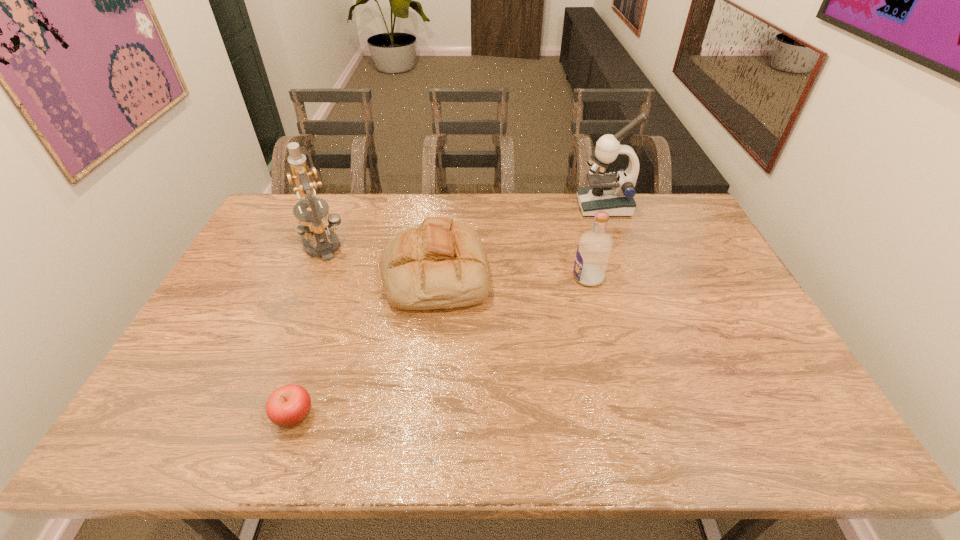
The image size is (960, 540). What are the coordinates of `free space located 0.200m on the label of the third shortest object` in the screenshot? It's located at (508, 278).

This screenshot has height=540, width=960. In order to click on free space located 0.290m on the label of the third shortest object in this screenshot , I will do `click(478, 278)`.

Find the location of a particular element. This screenshot has height=540, width=960. free location located 0.200m on the label of the third shortest object is located at coordinates (508, 278).

Locate an element on the screen. The width and height of the screenshot is (960, 540). vacant region located 0.160m on the right of the third object from right to left is located at coordinates (540, 274).

Find the location of a particular element. The width and height of the screenshot is (960, 540). vacant space located on the left of the shortest object is located at coordinates (144, 415).

You are a GUI agent. You are given a task and a screenshot of the screen. Output one action in this format:
    pyautogui.click(x=<x>, y=<y>)
    Task: Click on the object located at the near edge
    
    Given the screenshot: What is the action you would take?
    pyautogui.click(x=289, y=405)

The image size is (960, 540). I want to click on vacant space at the far edge of the desktop, so click(x=371, y=208).

Image resolution: width=960 pixels, height=540 pixels. Identify the location of vacant space at the left edge. (247, 342).

At what (x,y) coordinates should I click in order to perform the action: click on vacant space at the right edge of the desktop. Please return your answer as a coordinate pair (x, y). Looking at the image, I should click on (723, 310).

This screenshot has height=540, width=960. I want to click on unoccupied position between the shortest object and the vodka, so click(441, 346).